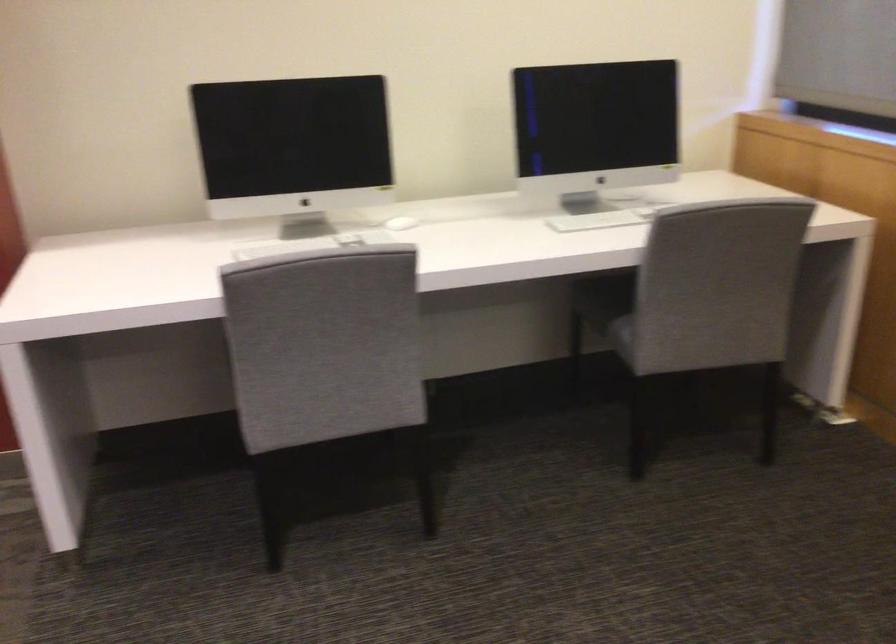
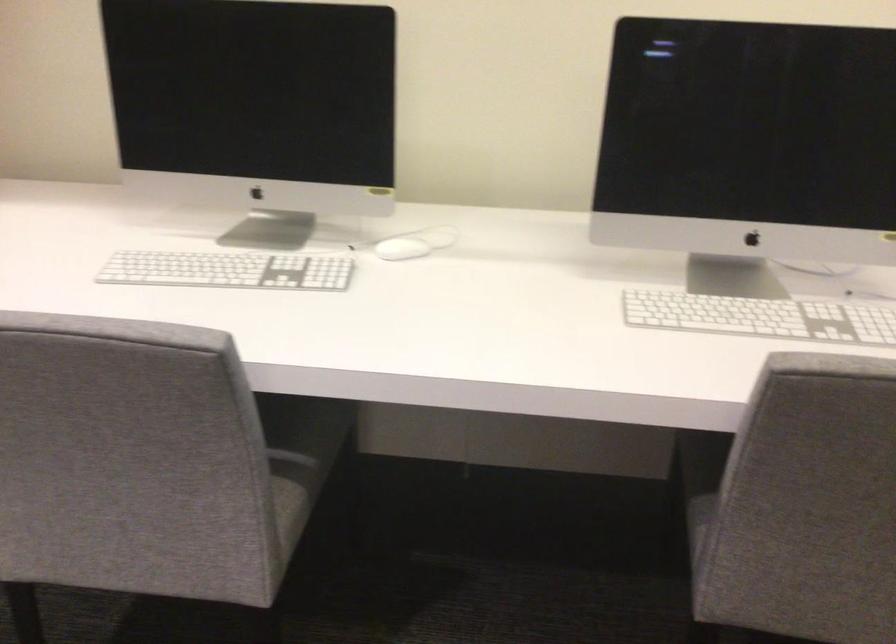
The point at (307, 245) is marked in the first image. Where is the corresponding point in the second image?

(228, 270)